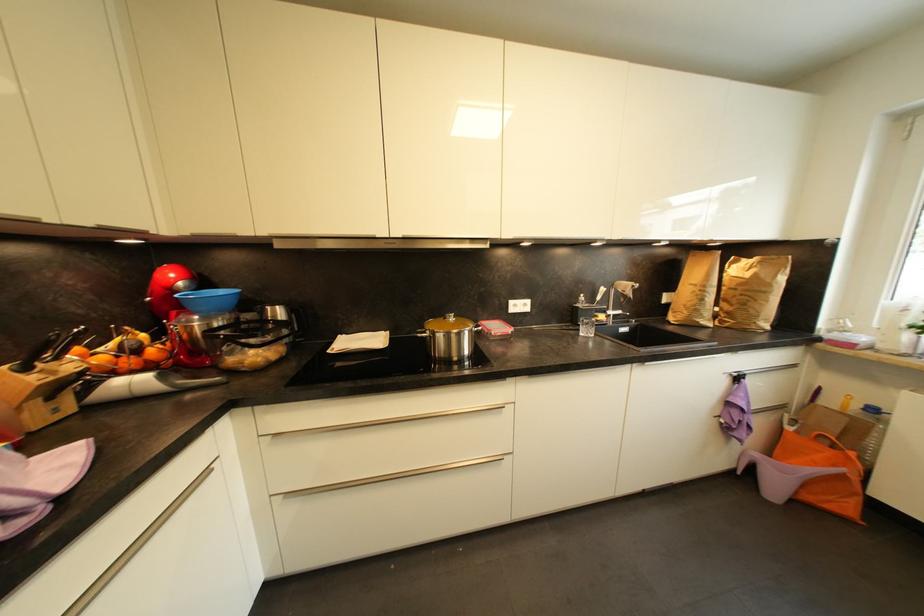
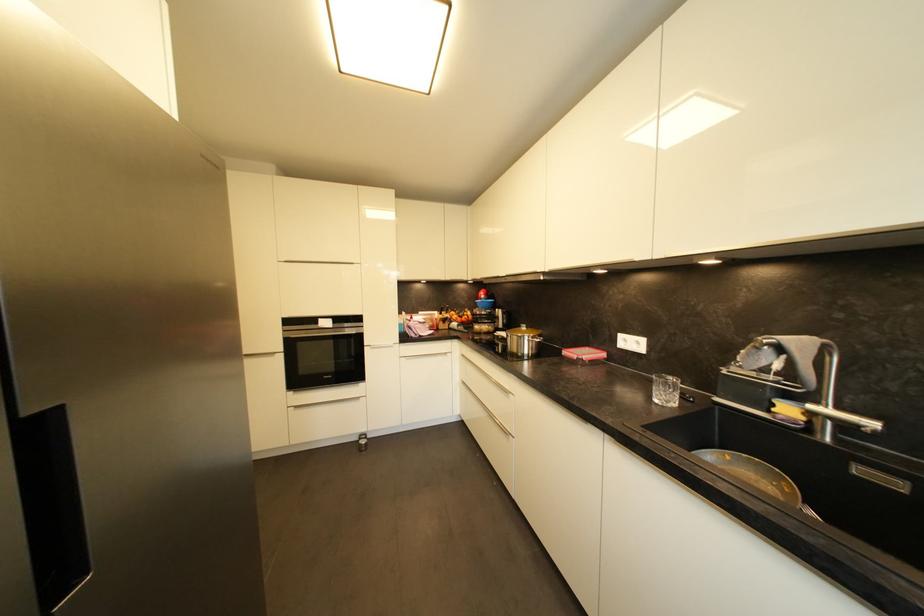
In the second image, find the point that corresponds to point (458, 318) in the first image.

(531, 330)